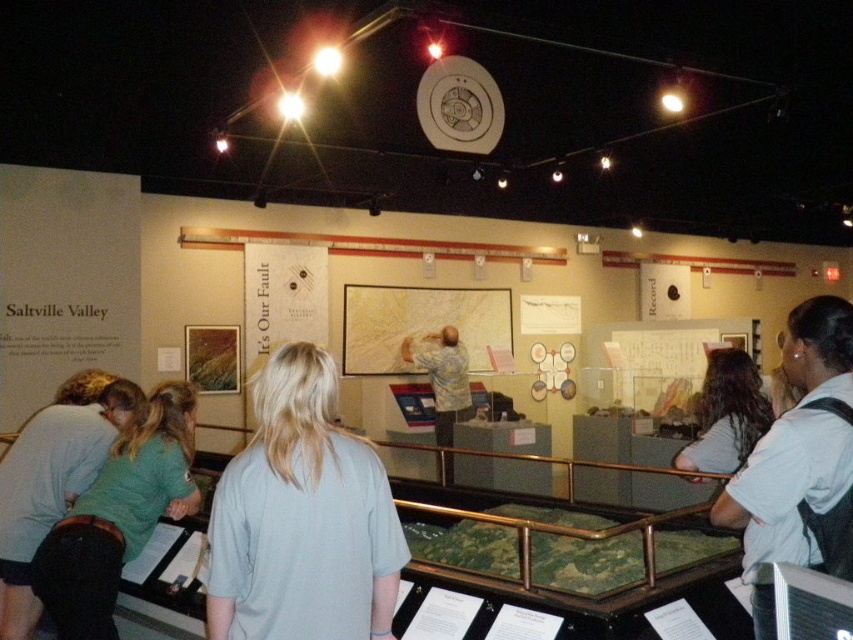
From the picture: Can you confirm if light blue shirt at center is wider than blonde hair at center?

Correct, the width of light blue shirt at center exceeds that of blonde hair at center.

Does point (817, 371) come farther from viewer compared to point (737, 440)?

No, it is in front of (737, 440).

What do you see at coordinates (798, 461) in the screenshot? I see `light blue shirt at center` at bounding box center [798, 461].

What are the coordinates of `light blue shirt at center` in the screenshot? It's located at (798, 461).

Which is above, light gray shirt at center or green fabric shirt at lower left?

light gray shirt at center is higher up.

Which is in front, point (345, 461) or point (71, 556)?

Point (345, 461)

The image size is (853, 640). What are the coordinates of `light gray shirt at center` in the screenshot? It's located at (302, 518).

Is light gray shirt at center further to the viewer compared to light blue shirt at center?

Yes, it is behind light blue shirt at center.

Is the position of light gray shirt at center less distant than that of light blue shirt at center?

That is False.

Is point (270, 426) less distant than point (822, 552)?

No.

The width and height of the screenshot is (853, 640). Identify the location of light gray shirt at center. (302, 518).